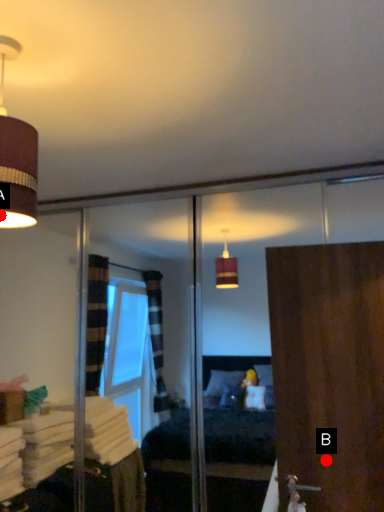
Question: Two points are circled on the image, labeled by A and B beside each circle. Which of the following is the farthest from the observer?

Choices:
 (A) A is further
 (B) B is further

Answer: (B)